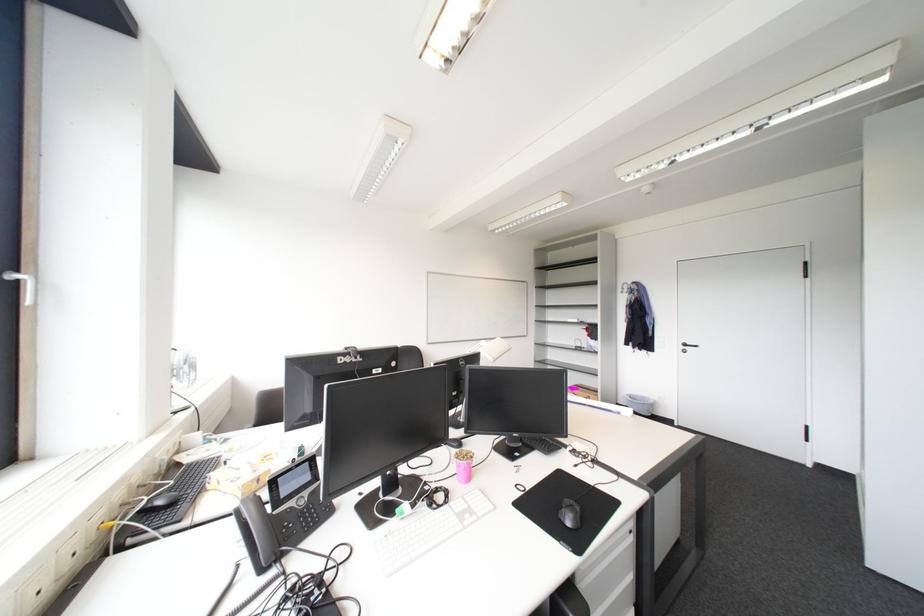
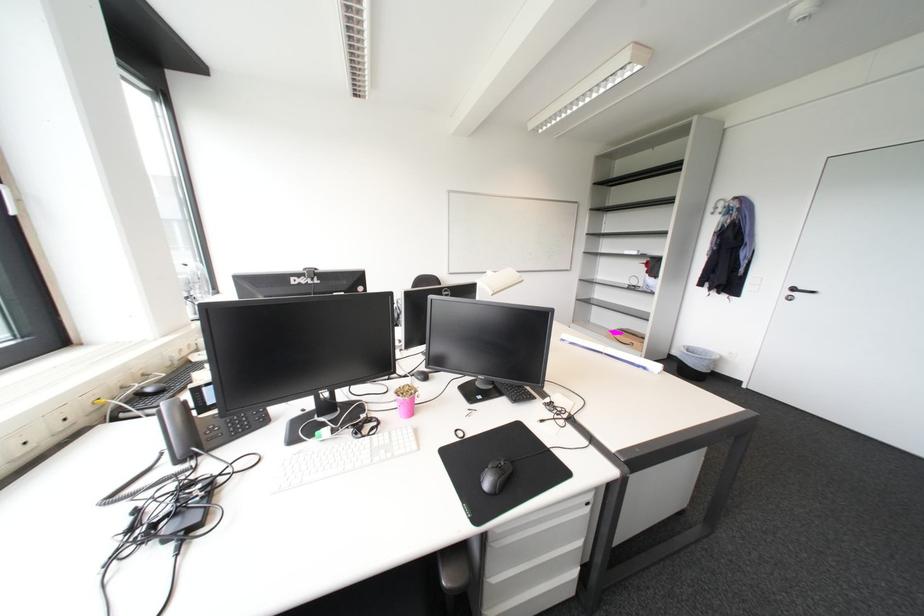
In the second image, find the point that corresponds to point 695,346 in the first image.

(805, 291)